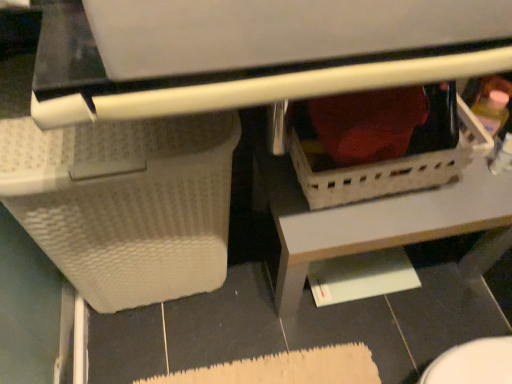
Question: From a real-world perspective, is white textured basket at lower left, marked as the first basket in a left-to-right arrangement, over black glossy tile at lower right?

Choices:
 (A) yes
 (B) no

Answer: (A)

Question: Can you confirm if white textured basket at lower left, marked as the first basket in a left-to-right arrangement, is shorter than black glossy tile at lower right?

Choices:
 (A) yes
 (B) no

Answer: (B)

Question: Could you tell me if white textured basket at lower left, marked as the first basket in a left-to-right arrangement, is turned towards black glossy tile at lower right?

Choices:
 (A) no
 (B) yes

Answer: (A)

Question: Can you confirm if white textured basket at lower left, which appears as the second basket when viewed from the right, is taller than black glossy tile at lower right?

Choices:
 (A) no
 (B) yes

Answer: (B)

Question: Is black glossy tile at lower right inside white textured basket at lower left, which appears as the second basket when viewed from the right?

Choices:
 (A) yes
 (B) no

Answer: (B)

Question: In the image, is white plastic basket at lower center positioned in front of or behind white plastic basket at center, positioned as the first basket in right-to-left order?

Choices:
 (A) behind
 (B) front

Answer: (A)

Question: Is white plastic basket at lower center wider or thinner than white plastic basket at center, the 2th basket when ordered from left to right?

Choices:
 (A) thin
 (B) wide

Answer: (B)

Question: Is white plastic basket at lower center bigger or smaller than white plastic basket at center, the 2th basket when ordered from left to right?

Choices:
 (A) big
 (B) small

Answer: (A)

Question: Choose the correct answer: Is white plastic basket at lower center inside white plastic basket at center, the 2th basket when ordered from left to right, or outside it?

Choices:
 (A) inside
 (B) outside

Answer: (B)

Question: From the image's perspective, is white plastic basket at lower center positioned above or below white textured basket at lower left, which appears as the second basket when viewed from the right?

Choices:
 (A) below
 (B) above

Answer: (B)

Question: In terms of width, does white plastic basket at lower center look wider or thinner when compared to white textured basket at lower left, marked as the first basket in a left-to-right arrangement?

Choices:
 (A) thin
 (B) wide

Answer: (B)

Question: From a real-world perspective, is white plastic basket at lower center positioned above or below white textured basket at lower left, which appears as the second basket when viewed from the right?

Choices:
 (A) below
 (B) above

Answer: (A)

Question: Based on their positions, is white plastic basket at lower center located to the left or right of white textured basket at lower left, which appears as the second basket when viewed from the right?

Choices:
 (A) left
 (B) right

Answer: (B)

Question: Considering the positions of white textured basket at lower left, which appears as the second basket when viewed from the right, and white plastic basket at center, the 2th basket when ordered from left to right, in the image, is white textured basket at lower left, which appears as the second basket when viewed from the right, wider or thinner than white plastic basket at center, the 2th basket when ordered from left to right,?

Choices:
 (A) wide
 (B) thin

Answer: (A)

Question: From the image's perspective, is white textured basket at lower left, which appears as the second basket when viewed from the right, positioned above or below white plastic basket at center, positioned as the first basket in right-to-left order?

Choices:
 (A) above
 (B) below

Answer: (B)